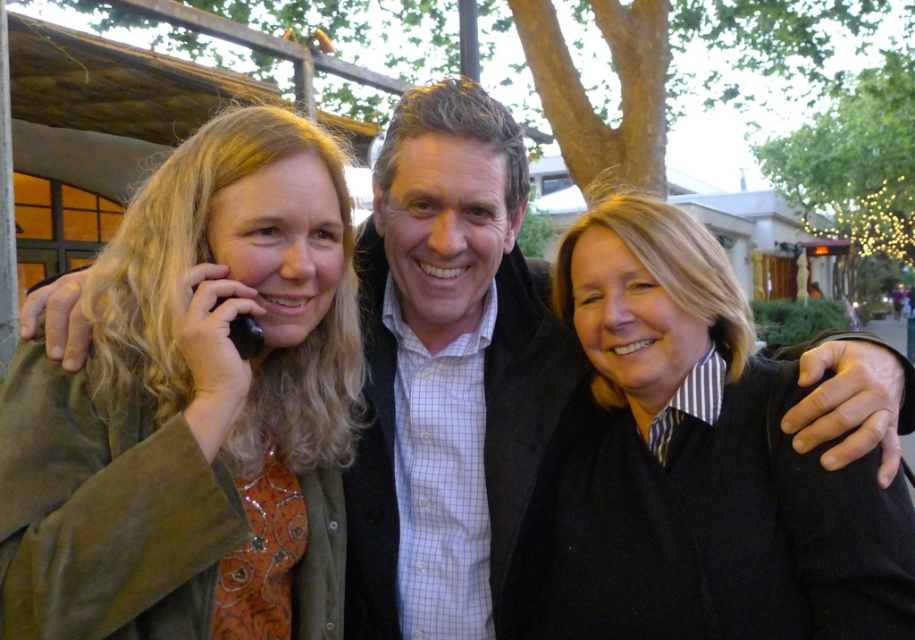
You are standing in the scene and want to locate the matte green jacket at left. Which coordinate point should you look at?

You should look at point (x=195, y=408) to find the matte green jacket at left.

Consider the image. You are a photographer trying to capture a group photo of the matte green jacket at left and the white checkered shirt at center. If you want to ensure both subjects are in focus, which one should you adjust your camera focus on first?

Since the matte green jacket at left is larger in size compared to the white checkered shirt at center, you should focus on the matte green jacket at left first to ensure both are in focus.

You are trying to identify clothing items in the scene. The black wool sweater at center and the white checkered shirt at center are both visible. Which clothing item is positioned lower on the person?

The black wool sweater at center is located below the white checkered shirt at center, so the black wool sweater at center is positioned lower.